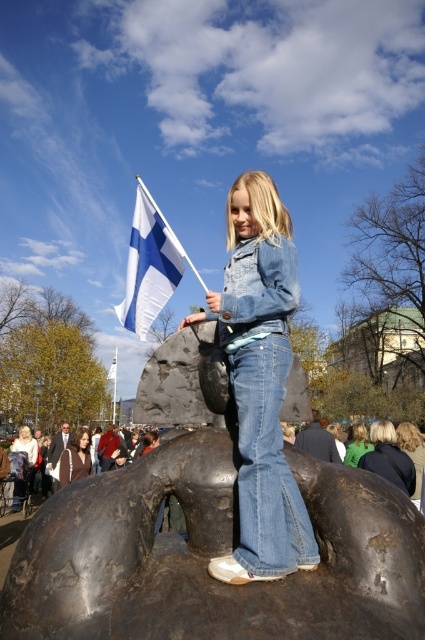
Image resolution: width=425 pixels, height=640 pixels. Describe the element at coordinates (209, 536) in the screenshot. I see `bronze sculpture at center` at that location.

Does bronze sculpture at center have a larger size compared to white fabric flag at upper left?

No, bronze sculpture at center is not bigger than white fabric flag at upper left.

Does point (136, 573) lie in front of point (150, 260)?

That is True.

Identify the location of bronze sculpture at center. The image size is (425, 640). (209, 536).

Which is more to the right, bronze sculpture at center or denim jacket at center?

denim jacket at center is more to the right.

Does bronze sculpture at center have a greater width compared to denim jacket at center?

Yes, bronze sculpture at center is wider than denim jacket at center.

Between point (161, 618) and point (243, 177), which one is positioned in front?

Point (161, 618) is more forward.

I want to click on bronze sculpture at center, so click(x=209, y=536).

Does denim jacket at center appear on the right side of white fabric flag at upper left?

Indeed, denim jacket at center is positioned on the right side of white fabric flag at upper left.

Is point (272, 464) positioned in front of point (136, 275)?

Yes, point (272, 464) is in front of point (136, 275).

The width and height of the screenshot is (425, 640). In order to click on denim jacket at center in this screenshot , I will do `click(260, 381)`.